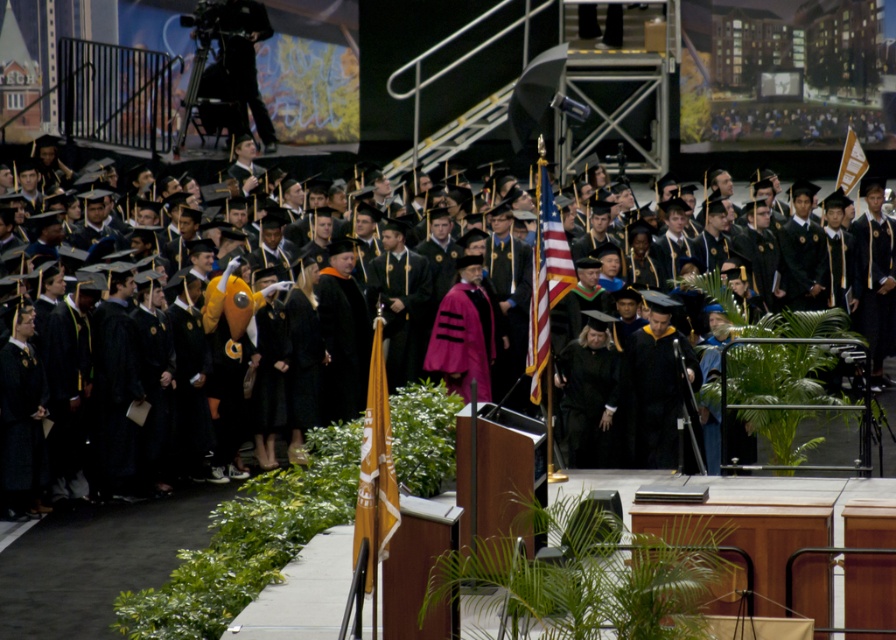
You are attending the graduation ceremony and need to locate the orange fabric flag at center. According to the coordinates provided, where exactly is it positioned on the stage?

The orange fabric flag at center is located at point coordinates of 0.733 on the x axis and 0.420 on the y axis.

You are a photographer at the graduation ceremony. You need to capture a photo that includes both the matte black graduation gown at center and the orange fabric flag at center. Which object should be placed to the right side in the photo?

The matte black graduation gown at center should be placed to the right side of the orange fabric flag at center in the photo.